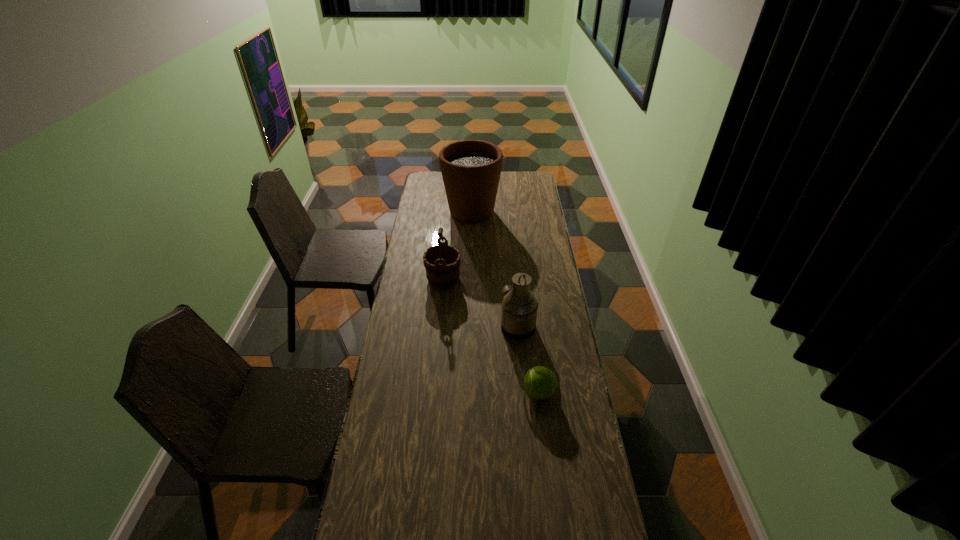
This screenshot has width=960, height=540. I want to click on vacant area in the image that satisfies the following two spatial constraints: 1. on the front side of the third nearest object; 2. on the left side of the tennis ball, so click(433, 393).

You are a GUI agent. You are given a task and a screenshot of the screen. Output one action in this format:
    pyautogui.click(x=<x>, y=<y>)
    Task: Click on the free spot that satisfies the following two spatial constraints: 1. on the front side of the farthest object; 2. on the left side of the pitcher
    The height and width of the screenshot is (540, 960).
    Given the screenshot: What is the action you would take?
    pyautogui.click(x=468, y=327)

The width and height of the screenshot is (960, 540). What are the coordinates of `vacant region that satisfies the following two spatial constraints: 1. on the front side of the shortest object; 2. on the right side of the wine bucket` in the screenshot? It's located at (433, 393).